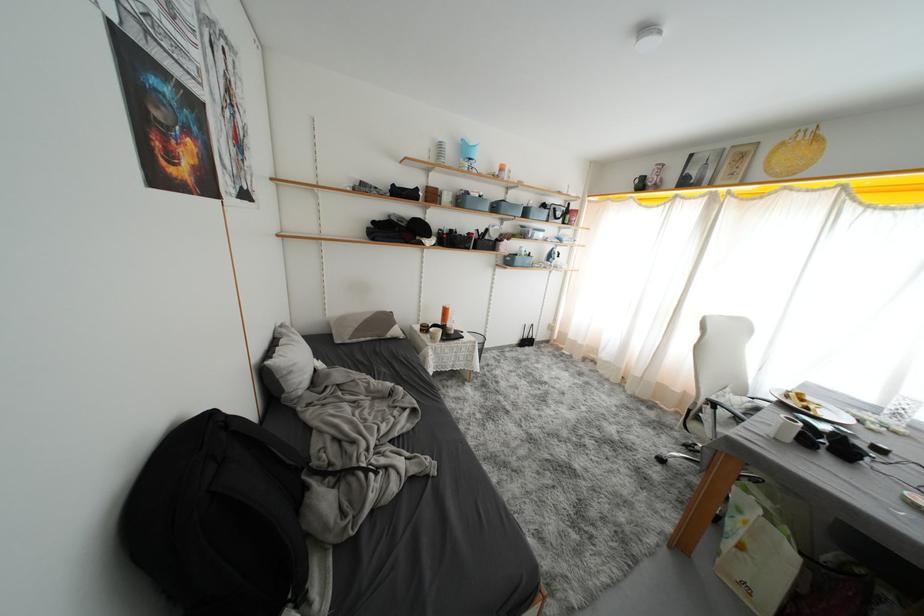
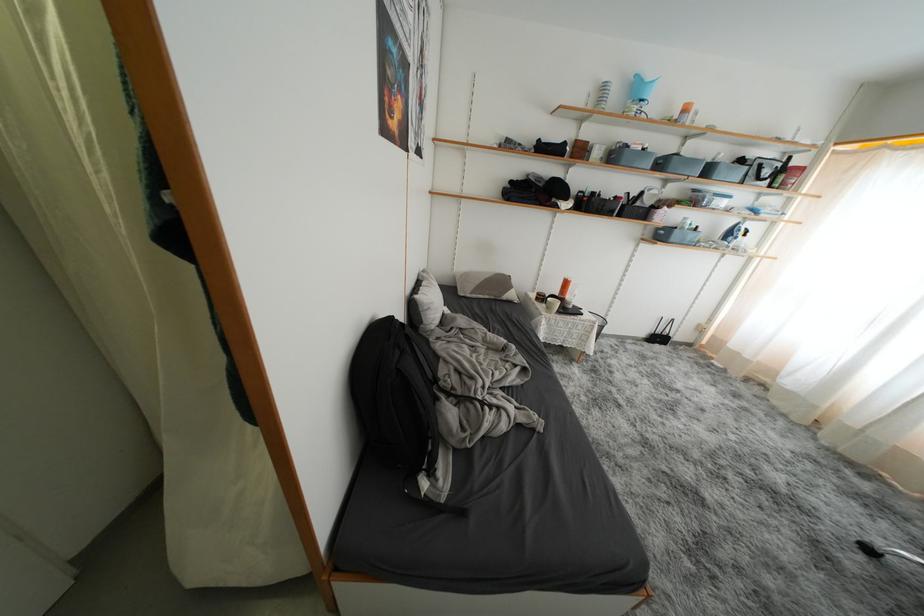
Where in the second image is the point corresponding to point (506, 265) from the first image?

(654, 238)